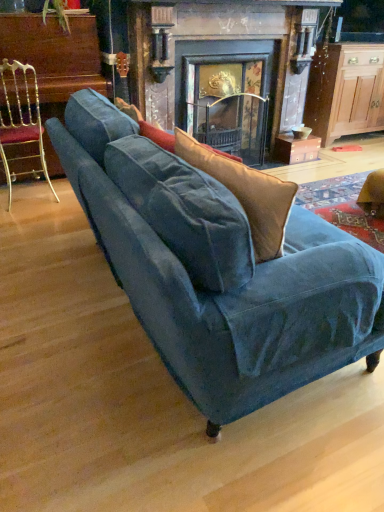
Based on the photo, measure the distance between dark gray stone fireplace at center and camera.

9.52 feet.

The width and height of the screenshot is (384, 512). Find the location of `wooden cabinet at right`. wooden cabinet at right is located at coordinates (345, 91).

The height and width of the screenshot is (512, 384). What do you see at coordinates (21, 121) in the screenshot?
I see `gold metallic chair at left` at bounding box center [21, 121].

In order to click on velvet blue couch at center in this screenshot , I will do 228,282.

You are a GUI agent. You are given a task and a screenshot of the screen. Output one action in this format:
    pyautogui.click(x=<x>, y=<y>)
    Task: Click on the dark gray stone fireplace at center
    
    Given the screenshot: What is the action you would take?
    pyautogui.click(x=224, y=68)

Image resolution: width=384 pixels, height=512 pixels. Identify the location of fireplace on the left of wooden cabinet at right. (224, 68).

Is dark gray stone fireplace at center taller or shorter than wooden cabinet at right?

→ dark gray stone fireplace at center is taller than wooden cabinet at right.

Is dark gray stone fireplace at center completely or partially outside of wooden cabinet at right?

dark gray stone fireplace at center is positioned outside wooden cabinet at right.

From the image's perspective, relative to wooden cabinet at right, is dark gray stone fireplace at center above or below?

Based on their image positions, dark gray stone fireplace at center is located beneath wooden cabinet at right.

You are a GUI agent. You are given a task and a screenshot of the screen. Output one action in this format:
    pyautogui.click(x=<x>, y=<y>)
    Task: Click on the fireplace above the velvet blue couch at center (from the image's perspective)
    The width and height of the screenshot is (384, 512).
    Given the screenshot: What is the action you would take?
    pyautogui.click(x=224, y=68)

Consider the image. Is dark gray stone fireplace at center at the back of velvet blue couch at center?

No.

Considering the positions of objects velvet blue couch at center and dark gray stone fireplace at center in the image provided, who is in front, velvet blue couch at center or dark gray stone fireplace at center?

velvet blue couch at center is in front.

From the picture: Is velvet blue couch at center far from dark gray stone fireplace at center?

That's right, there is a large distance between velvet blue couch at center and dark gray stone fireplace at center.

Does velvet blue couch at center contain wooden cabinet at right?

Definitely not — wooden cabinet at right is not inside velvet blue couch at center.

Is wooden cabinet at right at the back of velvet blue couch at center?

That's not correct — velvet blue couch at center is not looking away from wooden cabinet at right.

From the image's perspective, between velvet blue couch at center and wooden cabinet at right, which one is located above?

wooden cabinet at right.

Consider the image. Is velvet blue couch at center shorter than wooden cabinet at right?

Yes, velvet blue couch at center is shorter than wooden cabinet at right.

From the image's perspective, who appears lower, velvet blue couch at center or gold metallic chair at left?

From the image's view, velvet blue couch at center is below.

Considering the sizes of velvet blue couch at center and gold metallic chair at left in the image, is velvet blue couch at center wider or thinner than gold metallic chair at left?

velvet blue couch at center is wider than gold metallic chair at left.

From a real-world perspective, which object stands above the other?

From a 3D spatial view, gold metallic chair at left is above.

Based on the photo, is velvet blue couch at center inside the boundaries of gold metallic chair at left, or outside?

velvet blue couch at center is spatially situated outside gold metallic chair at left.

Is velvet blue couch at center located within gold metallic chair at left?

Actually, velvet blue couch at center is outside gold metallic chair at left.

Does gold metallic chair at left have a greater height compared to velvet blue couch at center?

Indeed, gold metallic chair at left has a greater height compared to velvet blue couch at center.

Is gold metallic chair at left next to velvet blue couch at center and touching it?

No, gold metallic chair at left is not next to velvet blue couch at center.

Does gold metallic chair at left contain wooden cabinet at right?

No.

How many degrees apart are the facing directions of gold metallic chair at left and wooden cabinet at right?

gold metallic chair at left and wooden cabinet at right are facing 178 degrees away from each other.

In the image, is gold metallic chair at left positioned in front of or behind wooden cabinet at right?

gold metallic chair at left is positioned closer to the viewer than wooden cabinet at right.

Which is more to the left, gold metallic chair at left or wooden cabinet at right?

From the viewer's perspective, gold metallic chair at left appears more on the left side.

From a real-world perspective, between wooden cabinet at right and gold metallic chair at left, who is vertically lower?

In real-world perspective, gold metallic chair at left is lower.

Locate an element on the screen. Image resolution: width=384 pixels, height=512 pixels. chair in front of the wooden cabinet at right is located at coordinates (21, 121).

Considering the positions of objects wooden cabinet at right and gold metallic chair at left in the image provided, who is more to the left, wooden cabinet at right or gold metallic chair at left?

gold metallic chair at left.

Locate an element on the screen. Image resolution: width=384 pixels, height=512 pixels. table behind the dark gray stone fireplace at center is located at coordinates (345, 91).

Identify the location of fireplace to the right of velvet blue couch at center. (224, 68).

Estimate the real-world distances between objects in this image. Which object is closer to wooden cabinet at right, gold metallic chair at left or dark gray stone fireplace at center?

The object closer to wooden cabinet at right is dark gray stone fireplace at center.

From the picture: Which object lies nearer to the anchor point velvet blue couch at center, wooden cabinet at right or dark gray stone fireplace at center?

Based on the image, dark gray stone fireplace at center appears to be nearer to velvet blue couch at center.

Considering their positions, is velvet blue couch at center positioned further to wooden cabinet at right than gold metallic chair at left?

velvet blue couch at center is further to wooden cabinet at right.

Estimate the real-world distances between objects in this image. Which object is further from velvet blue couch at center, gold metallic chair at left or dark gray stone fireplace at center?

dark gray stone fireplace at center.

Based on their spatial positions, is wooden cabinet at right or gold metallic chair at left further from velvet blue couch at center?

wooden cabinet at right.

From the image, which object appears to be nearer to gold metallic chair at left, dark gray stone fireplace at center or velvet blue couch at center?

dark gray stone fireplace at center lies closer to gold metallic chair at left than the other object.

Looking at the image, which one is located closer to gold metallic chair at left, dark gray stone fireplace at center or wooden cabinet at right?

The object closer to gold metallic chair at left is dark gray stone fireplace at center.

Which object lies nearer to the anchor point dark gray stone fireplace at center, wooden cabinet at right or gold metallic chair at left?

The object closer to dark gray stone fireplace at center is wooden cabinet at right.

I want to click on fireplace between velvet blue couch at center and wooden cabinet at right along the z-axis, so click(224, 68).

Where is `chair positioned between velvet blue couch at center and wooden cabinet at right from near to far`? The width and height of the screenshot is (384, 512). chair positioned between velvet blue couch at center and wooden cabinet at right from near to far is located at coordinates (21, 121).

The height and width of the screenshot is (512, 384). Identify the location of chair located between velvet blue couch at center and dark gray stone fireplace at center in the depth direction. pos(21,121).

Where is `fireplace between gold metallic chair at left and wooden cabinet at right`? This screenshot has width=384, height=512. fireplace between gold metallic chair at left and wooden cabinet at right is located at coordinates (224, 68).